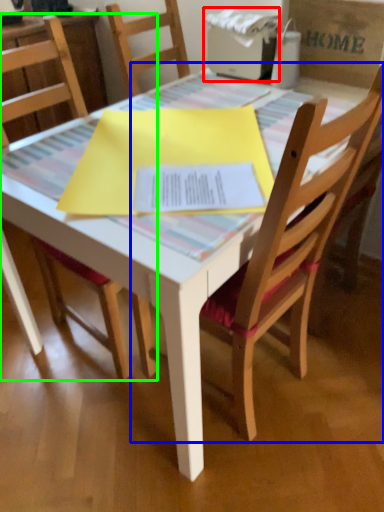
Question: Which object is the closest to the printer (highlighted by a red box)? Choose among these: chair (highlighted by a blue box) or chair (highlighted by a green box).

Choices:
 (A) chair
 (B) chair

Answer: (A)